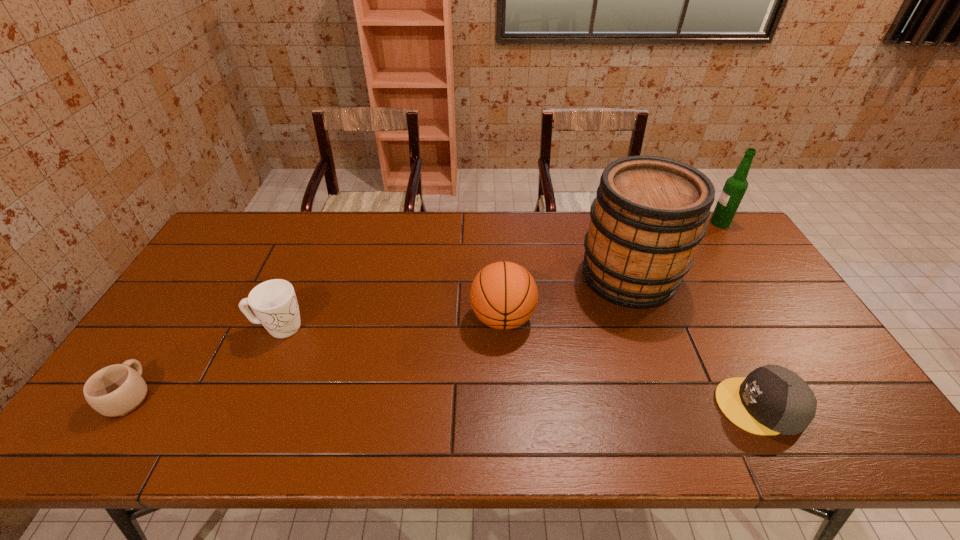
At what (x,y) coordinates should I click in order to perform the action: click on empty location between the leftmost object and the tallest object. Please return your answer as a coordinate pair (x, y). Image resolution: width=960 pixels, height=540 pixels. Looking at the image, I should click on (379, 335).

The image size is (960, 540). Identify the location of vacant area that lies between the cap and the basketball. (632, 362).

This screenshot has height=540, width=960. I want to click on vacant space in between the cider and the left mug, so click(x=379, y=335).

This screenshot has width=960, height=540. In order to click on free space between the cap and the rightmost object in this screenshot , I will do `click(740, 314)`.

What are the coordinates of `object that is the third closest one to the tallest object` in the screenshot? It's located at (735, 186).

Where is `the fourth closest object to the cap`? the fourth closest object to the cap is located at coordinates (274, 302).

The image size is (960, 540). In order to click on free region that satisfies the following two spatial constraints: 1. on the label of the farthest object; 2. on the front side of the fourth object from right to left in this screenshot , I will do `click(783, 318)`.

Where is `vacant space that satisfies the following two spatial constraints: 1. on the back side of the third object from left to right; 2. on the right side of the cider`? This screenshot has height=540, width=960. vacant space that satisfies the following two spatial constraints: 1. on the back side of the third object from left to right; 2. on the right side of the cider is located at coordinates (500, 276).